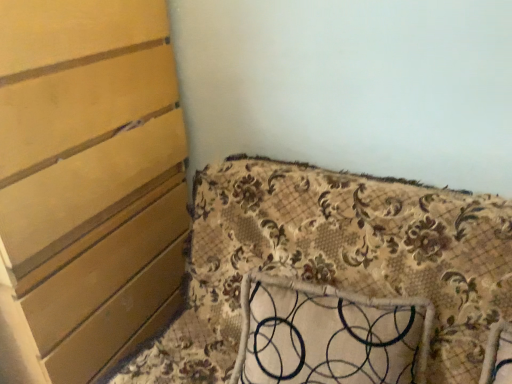
Question: Is floral fabric cushion at lower right located within matte wood chest of drawers at left?

Choices:
 (A) no
 (B) yes

Answer: (A)

Question: Considering the relative positions of matte wood chest of drawers at left and floral fabric cushion at lower right in the image provided, is matte wood chest of drawers at left to the right of floral fabric cushion at lower right from the viewer's perspective?

Choices:
 (A) yes
 (B) no

Answer: (B)

Question: Is matte wood chest of drawers at left positioned behind floral fabric cushion at lower right?

Choices:
 (A) yes
 (B) no

Answer: (A)

Question: Would you say matte wood chest of drawers at left is outside floral fabric cushion at lower right?

Choices:
 (A) yes
 (B) no

Answer: (A)

Question: Does matte wood chest of drawers at left have a smaller size compared to floral fabric cushion at lower right?

Choices:
 (A) no
 (B) yes

Answer: (B)

Question: Looking at their shapes, would you say matte wood chest of drawers at left is wider or thinner than floral fabric cushion at lower right?

Choices:
 (A) thin
 (B) wide

Answer: (A)

Question: From a real-world perspective, relative to floral fabric cushion at lower right, is matte wood chest of drawers at left vertically above or below?

Choices:
 (A) above
 (B) below

Answer: (A)

Question: Visually, is matte wood chest of drawers at left positioned to the left or to the right of floral fabric cushion at lower right?

Choices:
 (A) left
 (B) right

Answer: (A)

Question: Is matte wood chest of drawers at left situated inside floral fabric cushion at lower right or outside?

Choices:
 (A) inside
 (B) outside

Answer: (B)

Question: In terms of width, does floral fabric pillow at center look wider or thinner when compared to floral fabric cushion at lower right?

Choices:
 (A) thin
 (B) wide

Answer: (A)

Question: From the image's perspective, is floral fabric pillow at center positioned above or below floral fabric cushion at lower right?

Choices:
 (A) below
 (B) above

Answer: (A)

Question: In the image, is floral fabric pillow at center positioned in front of or behind floral fabric cushion at lower right?

Choices:
 (A) front
 (B) behind

Answer: (B)

Question: Is floral fabric pillow at center inside or outside of floral fabric cushion at lower right?

Choices:
 (A) inside
 (B) outside

Answer: (A)

Question: In the image, is floral fabric pillow at center positioned in front of or behind matte wood chest of drawers at left?

Choices:
 (A) front
 (B) behind

Answer: (B)

Question: Choose the correct answer: Is floral fabric pillow at center inside matte wood chest of drawers at left or outside it?

Choices:
 (A) outside
 (B) inside

Answer: (A)